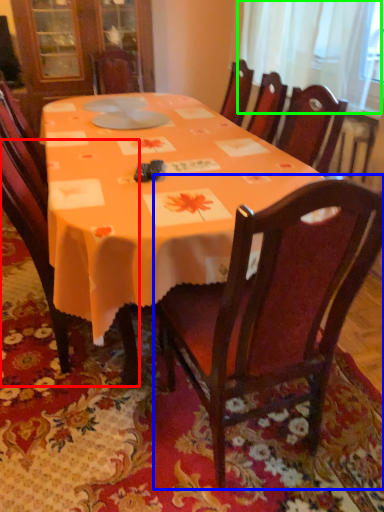
Question: Estimate the real-world distances between objects in this image. Which object is farther from chair (highlighted by a red box), chair (highlighted by a blue box) or curtain (highlighted by a green box)?

Choices:
 (A) chair
 (B) curtain

Answer: (B)